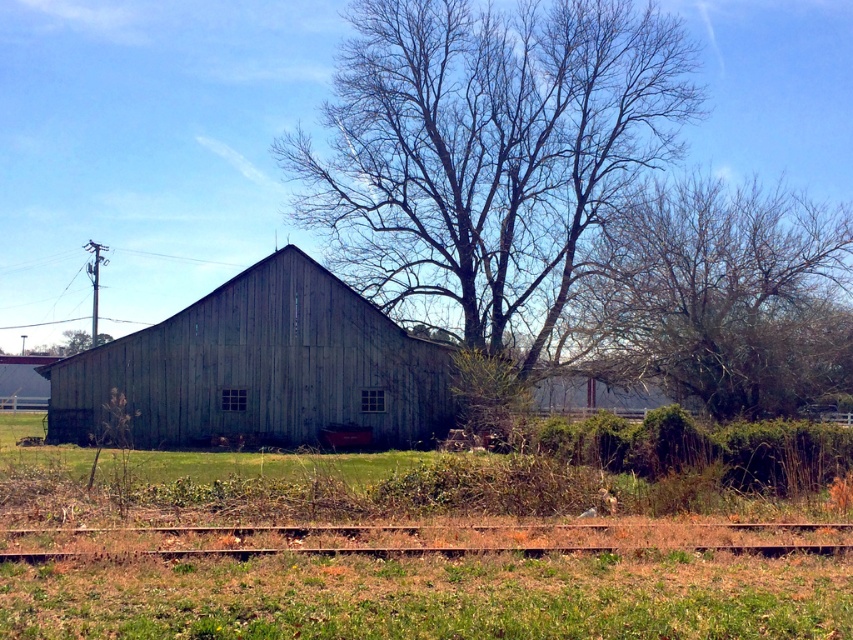
Which is in front, point (544, 237) or point (752, 310)?

Point (752, 310)

Between smooth gray bark tree at center and brown textured tree at upper right, which one appears on the left side from the viewer's perspective?

smooth gray bark tree at center is more to the left.

Is point (439, 28) farther from viewer compared to point (647, 296)?

That is True.

Locate an element on the screen. smooth gray bark tree at center is located at coordinates (486, 152).

Who is positioned more to the right, brown textured tree at upper right or rusty metal train track at lower center?

brown textured tree at upper right is more to the right.

Image resolution: width=853 pixels, height=640 pixels. What do you see at coordinates (720, 296) in the screenshot?
I see `brown textured tree at upper right` at bounding box center [720, 296].

You are a GUI agent. You are given a task and a screenshot of the screen. Output one action in this format:
    pyautogui.click(x=<x>, y=<y>)
    Task: Click on the brown textured tree at upper right
    The height and width of the screenshot is (640, 853).
    Given the screenshot: What is the action you would take?
    pyautogui.click(x=720, y=296)

Who is more distant from viewer, [659,348] or [207,332]?

Point [207,332]

Is brown textured tree at upper right above weathered wood barn at center?

Correct, brown textured tree at upper right is located above weathered wood barn at center.

Who is more forward, (756, 378) or (242, 429)?

Positioned in front is point (756, 378).

Identify the location of brown textured tree at upper right. (720, 296).